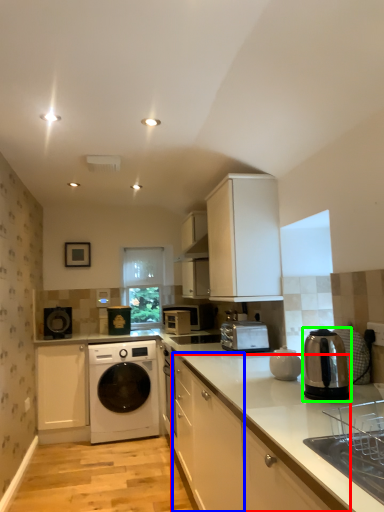
Question: Considering the real-world distances, which object is farthest from cabinetry (highlighted by a red box)? cabinetry (highlighted by a blue box) or home appliance (highlighted by a green box)?

Choices:
 (A) cabinetry
 (B) home appliance

Answer: (B)